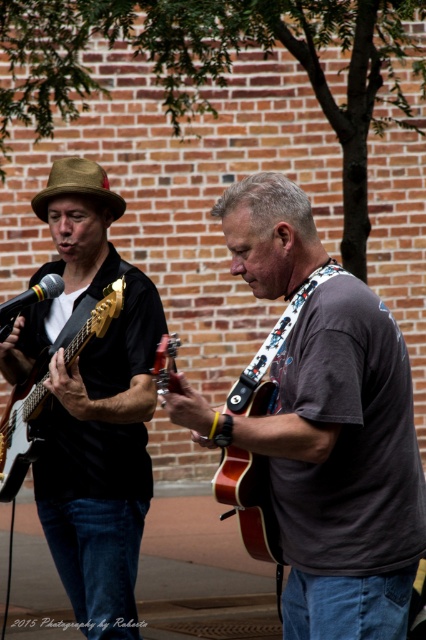
You are a stagehand setting up for a concert. You need to place a 1.2 meter wide equipment stand between the matte brown guitar at center and the glossy wood guitar at left. Will the stand fit between them considering their widths?

The matte brown guitar at center is wider than the glossy wood guitar at left. Since the stand is 1.2 meters wide, but the description only states the width comparison between the guitars, not the actual space between them, it is impossible to determine if the stand will fit based on the given information.

You are setting up a music stand between the wooden acoustic guitar at center and the black matte microphone at left. Since the stand requires 30 cm of space, can it fit between them?

The wooden acoustic guitar at center is wider than the black matte microphone at left. However, the description does not provide the exact distance between them, so we cannot determine if the 30 cm music stand will fit.

You are a photographer standing at the center of the stage. You want to take a closeup photo of the matte brown guitar at center. According to the coordinates provided, in which direction should you move to get closer to it?

The matte brown guitar at center is located at point (336,465). Since the photographer is at the center of the stage, moving towards the coordinates would require moving towards the lower right direction to get closer to the matte brown guitar at center.